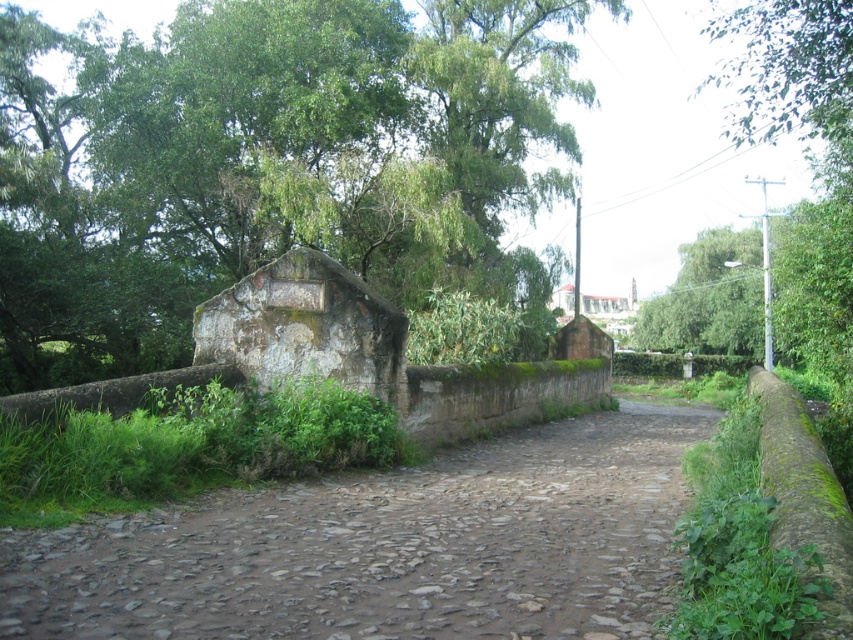
You are a hiker planning to take a photo of the brown stone path at center. You want to include the green leafy tree at upper center in the background to show its size relative to the path. Will the tree appear larger than the path in the photo?

The green leafy tree at upper center is larger in size compared to the brown stone path at center, so in the photo, the tree will appear larger than the path.

You are a hiker walking along the cobblestone path and want to reach a specific point ahead. You notice two markers on the path labeled point 1 at coordinates (387, 278) and point 2 at (636, 541). If you are currently standing at point 2, which direction should you face to see point 1 behind you?

Since point 1 is behind point 2, if you are standing at point 2, you should face away from point 1 to have it behind you. Therefore, facing the opposite direction of point 1 would place it behind you.